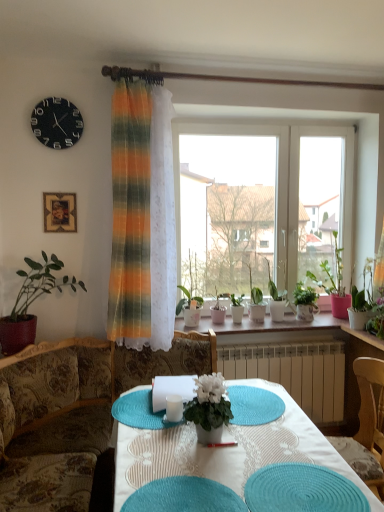
Where is `wooden frame at upper left`? This screenshot has width=384, height=512. wooden frame at upper left is located at coordinates (60, 212).

The height and width of the screenshot is (512, 384). I want to click on green matte plant at left, which ranks as the 1th houseplant in left-to-right order, so click(x=31, y=302).

In terms of height, does green glossy plant at right look taller or shorter compared to white ceramic pots at center?

green glossy plant at right is taller than white ceramic pots at center.

Is green glossy plant at right wider or thinner than white ceramic pots at center?

green glossy plant at right is thinner than white ceramic pots at center.

In order to click on window sill located underneath the green glossy plant at right (from a real-world perspective) in this screenshot , I will do `click(285, 330)`.

From a real-world perspective, is green glossy plant at upper center, which ranks as the second houseplant in right-to-left order, over wooden frame at upper left?

No, from a real-world perspective, green glossy plant at upper center, which ranks as the second houseplant in right-to-left order, is not on top of wooden frame at upper left.

From the picture: Between green glossy plant at upper center, which is counted as the 1th houseplant, starting from the back, and wooden frame at upper left, which one has larger width?

green glossy plant at upper center, which is counted as the 1th houseplant, starting from the back, is wider.

Is green glossy plant at upper center, marked as the 6th houseplant in a front-to-back arrangement, shorter than wooden frame at upper left?

In fact, green glossy plant at upper center, marked as the 6th houseplant in a front-to-back arrangement, may be taller than wooden frame at upper left.

Does point (281, 311) come behind point (74, 215)?

Yes, point (281, 311) is farther from viewer.

Are wooden frame at upper left and white matte flower pot at center, arranged as the 1th houseplant when viewed from the front, located far from each other?

Yes, wooden frame at upper left is far from white matte flower pot at center, arranged as the 1th houseplant when viewed from the front.

Which of these two, wooden frame at upper left or white matte flower pot at center, arranged as the 1th houseplant when viewed from the front, stands shorter?

Standing shorter between the two is wooden frame at upper left.

Can you tell me how much wooden frame at upper left and white matte flower pot at center, positioned as the 3th houseplant in left-to-right order, differ in facing direction?

6.5 degrees.

Which is more to the left, wooden frame at upper left or white matte flower pot at center, the 6th houseplant when ordered from back to front?

Positioned to the left is wooden frame at upper left.

From the image's perspective, is black matte clock at upper left on patterned fabric chair at left, positioned as the second chair in back-to-front order?

Yes, from the image's perspective, black matte clock at upper left is on top of patterned fabric chair at left, positioned as the second chair in back-to-front order.

Is black matte clock at upper left positioned beyond the bounds of patterned fabric chair at left, positioned as the second chair in back-to-front order?

Absolutely, black matte clock at upper left is external to patterned fabric chair at left, positioned as the second chair in back-to-front order.

Identify the location of clock on the left of patterned fabric chair at left, the first chair in the front-to-back sequence. This screenshot has width=384, height=512. (57, 123).

Is black matte clock at upper left turned away from patterned fabric chair at left, the second chair from the right?

No, black matte clock at upper left's orientation is not away from patterned fabric chair at left, the second chair from the right.

Can you tell me how much white matte flower pot at center, the 6th houseplant when ordered from back to front, and patterned fabric chair at left, the second chair from the right, differ in facing direction?

They differ by 95.5 degrees in their facing directions.

From the image's perspective, is white matte flower pot at center, the fourth houseplant viewed from the right, under patterned fabric chair at left, positioned as the second chair in back-to-front order?

No, from the image's perspective, white matte flower pot at center, the fourth houseplant viewed from the right, is not below patterned fabric chair at left, positioned as the second chair in back-to-front order.

Which object is wider, white matte flower pot at center, arranged as the 1th houseplant when viewed from the front, or patterned fabric chair at left, the first chair viewed from the left?

With larger width is patterned fabric chair at left, the first chair viewed from the left.

From a real-world perspective, is white matte flower pot at center, the 6th houseplant when ordered from back to front, physically located above or below patterned fabric chair at left, the first chair in the front-to-back sequence?

Clearly, from a real-world perspective, white matte flower pot at center, the 6th houseplant when ordered from back to front, is above patterned fabric chair at left, the first chair in the front-to-back sequence.

How different are the orientations of green matte plant at center, which is the 2th houseplant in back-to-front order, and green matte plant at left, which ranks as the 1th houseplant in left-to-right order, in degrees?

The facing directions of green matte plant at center, which is the 2th houseplant in back-to-front order, and green matte plant at left, which ranks as the 1th houseplant in left-to-right order, are 0.916 degrees apart.

Between green matte plant at center, which is the 2th houseplant in back-to-front order, and green matte plant at left, the 2th houseplant when ordered from front to back, which one has larger size?

Bigger between the two is green matte plant at left, the 2th houseplant when ordered from front to back.

Choose the correct answer: Is green matte plant at center, which is the 2th houseplant in back-to-front order, inside green matte plant at left, which is counted as the sixth houseplant, starting from the right, or outside it?

green matte plant at center, which is the 2th houseplant in back-to-front order, exists outside the volume of green matte plant at left, which is counted as the sixth houseplant, starting from the right.

Based on the photo, between green matte plant at center, positioned as the 5th houseplant in front-to-back order, and green matte plant at left, which ranks as the 1th houseplant in left-to-right order, which one has larger width?

green matte plant at left, which ranks as the 1th houseplant in left-to-right order, is wider.

Is green matte plant at center, which is the 2th houseplant in back-to-front order, positioned far away from green glossy plant at right?

green matte plant at center, which is the 2th houseplant in back-to-front order, is actually quite close to green glossy plant at right.

Would you say green matte plant at center, positioned as the 5th houseplant in front-to-back order, is to the left or to the right of green glossy plant at right in the picture?

Based on their positions, green matte plant at center, positioned as the 5th houseplant in front-to-back order, is located to the left of green glossy plant at right.

Can you confirm if green matte plant at center, which is the 2th houseplant in back-to-front order, is shorter than green glossy plant at right?

Yes, green matte plant at center, which is the 2th houseplant in back-to-front order, is shorter than green glossy plant at right.

What are the coordinates of `window sill behind the green glossy plant at right` in the screenshot? It's located at (285, 330).

Where is `picture frame lying on the left of green glossy plant at upper center, marked as the 6th houseplant in a front-to-back arrangement`? The width and height of the screenshot is (384, 512). picture frame lying on the left of green glossy plant at upper center, marked as the 6th houseplant in a front-to-back arrangement is located at coordinates (60, 212).

Considering their positions, is black matte clock at upper left positioned closer to wooden chair at right, which appears as the 2th chair when viewed from the front, than blue woven placemat at center?

blue woven placemat at center.

Based on the photo, estimate the real-world distances between objects in this image. Which object is closer to green glossy plant at right, wooden frame at upper left or white fabric table at center?

white fabric table at center lies closer to green glossy plant at right than the other object.

Based on their spatial positions, is black matte clock at upper left or wooden frame at upper left closer to patterned fabric chair at left, the first chair viewed from the left?

wooden frame at upper left lies closer to patterned fabric chair at left, the first chair viewed from the left, than the other object.

Based on the photo, considering their positions, is white ceramic pots at center positioned further to green glossy plant at right than green matte plant at left, which is counted as the sixth houseplant, starting from the right?

green matte plant at left, which is counted as the sixth houseplant, starting from the right, lies further to green glossy plant at right than the other object.

Considering their positions, is pink matte pot at right, arranged as the 1th houseplant when viewed from the right, positioned closer to black matte clock at upper left than white ceramic pots at center?

The object closer to black matte clock at upper left is white ceramic pots at center.

Estimate the real-world distances between objects in this image. Which object is further from green glossy plant at upper center, marked as the 6th houseplant in a front-to-back arrangement, green glossy plant at right or patterned fabric chair at left, the second chair from the right?

patterned fabric chair at left, the second chair from the right, is positioned further to the anchor green glossy plant at upper center, marked as the 6th houseplant in a front-to-back arrangement.

Looking at the image, which one is located further to green glossy plant at right, green matte plant at left, acting as the fifth houseplant starting from the back, or wooden chair at right, which appears as the 2th chair when viewed from the front?

Based on the image, green matte plant at left, acting as the fifth houseplant starting from the back, appears to be further to green glossy plant at right.

Looking at the image, which one is located further to white fabric table at center, green glossy plant at upper center, which is counted as the 1th houseplant, starting from the back, or green glossy plant at right?

green glossy plant at upper center, which is counted as the 1th houseplant, starting from the back, is further to white fabric table at center.

Where is `clock positioned between teal fabric placemat at lower center and green matte plant at center, which is the 2th houseplant in back-to-front order, from near to far`? clock positioned between teal fabric placemat at lower center and green matte plant at center, which is the 2th houseplant in back-to-front order, from near to far is located at coordinates pos(57,123).

At what (x,y) coordinates should I click in order to perform the action: click on mat between white fabric table at center and green matte plant at center, which ranks as the fourth houseplant in left-to-right order, in the front-back direction. Please return your answer as a coordinate pair (x, y). The width and height of the screenshot is (384, 512). Looking at the image, I should click on (254, 405).

You are a GUI agent. You are given a task and a screenshot of the screen. Output one action in this format:
    pyautogui.click(x=<x>, y=<y>)
    Task: Click on the table between teal woven placemat at center and blue woven placemat at center along the z-axis
    The width and height of the screenshot is (384, 512).
    Given the screenshot: What is the action you would take?
    pyautogui.click(x=226, y=451)

This screenshot has width=384, height=512. I want to click on table positioned between teal fabric placemat at lower center and green matte plant at center, the 2th houseplant in the left-to-right sequence, from near to far, so click(226, 451).